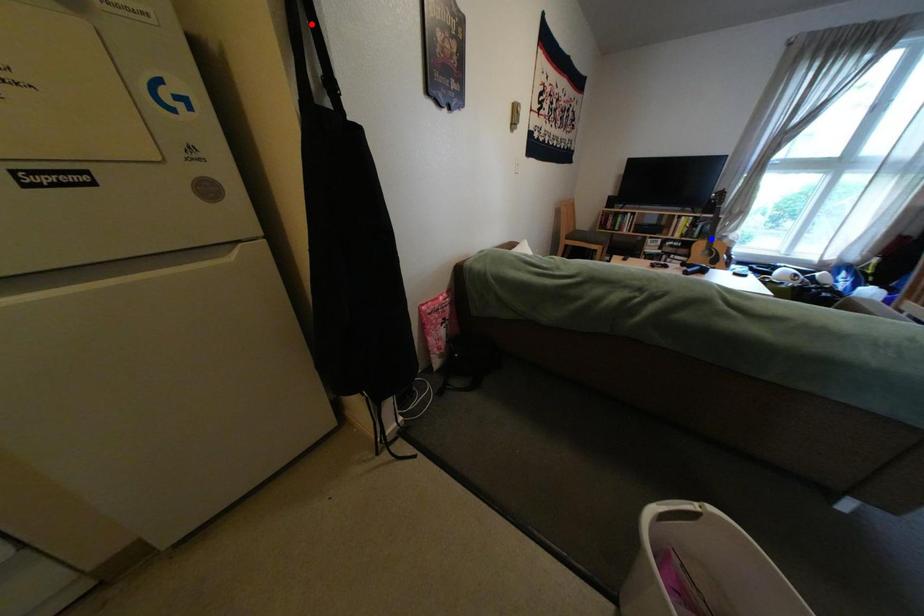
Question: Two points are marked on the image. Which point is closer to the camera?

Choices:
 (A) Blue point is closer.
 (B) Red point is closer.

Answer: (B)